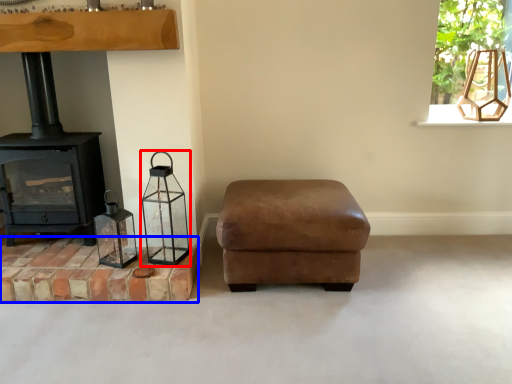
Question: Which object is closer to the camera taking this photo, candle holder (highlighted by a red box) or brickwork (highlighted by a blue box)?

Choices:
 (A) candle holder
 (B) brickwork

Answer: (A)